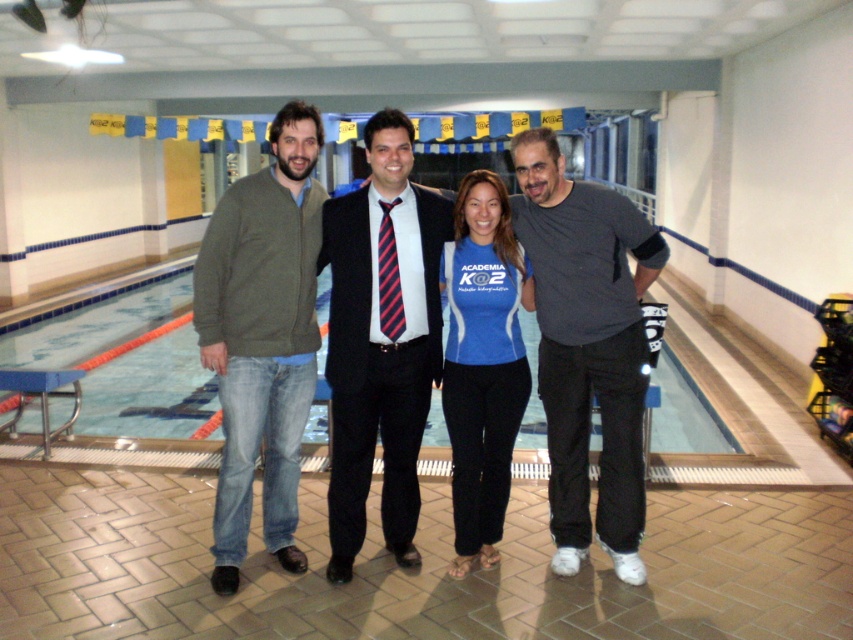
Question: Can you confirm if black suit at center is wider than blue tile swimming pool at center?

Choices:
 (A) yes
 (B) no

Answer: (A)

Question: Which point is farther to the camera?

Choices:
 (A) (630, 424)
 (B) (291, 230)

Answer: (A)

Question: Which is farther from the dark gray sweatshirt at right?

Choices:
 (A) green sweater at left
 (B) blue tile swimming pool at center
 (C) blue fabric shirt at center
 (D) black suit at center

Answer: (B)

Question: Can you confirm if green sweater at left is positioned to the right of blue fabric shirt at center?

Choices:
 (A) yes
 (B) no

Answer: (B)

Question: Based on their relative distances, which object is farther from the dark gray sweatshirt at right?

Choices:
 (A) black suit at center
 (B) blue tile swimming pool at center
 (C) blue fabric shirt at center
 (D) green sweater at left

Answer: (B)

Question: Can you confirm if blue tile swimming pool at center is positioned to the right of blue fabric shirt at center?

Choices:
 (A) no
 (B) yes

Answer: (A)